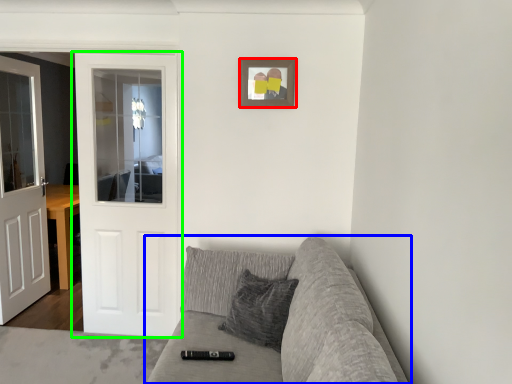
Question: Based on their relative distances, which object is nearer to picture frame (highlighted by a red box)? Choose from studio couch (highlighted by a blue box) and door (highlighted by a green box).

Choices:
 (A) studio couch
 (B) door

Answer: (A)